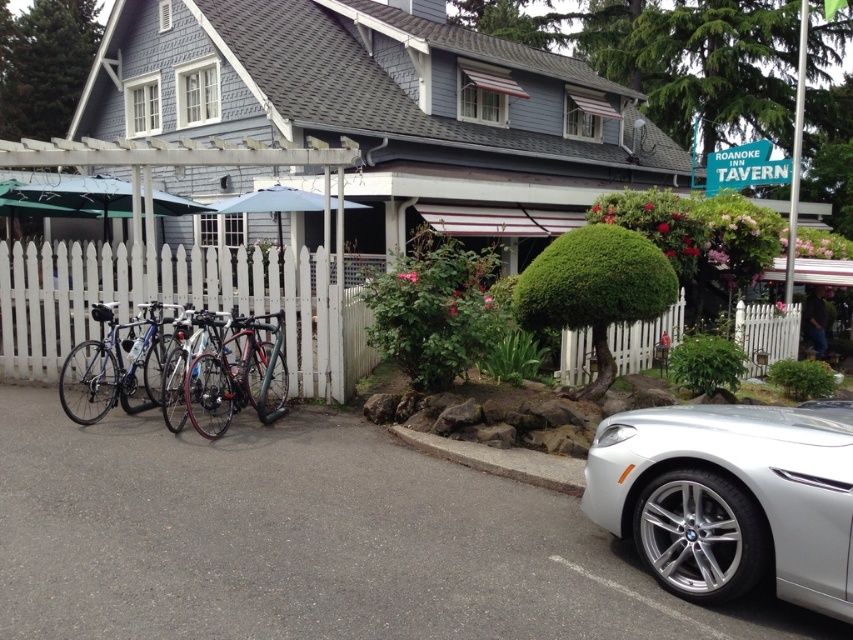
Can you confirm if white picket fence at left is shorter than shiny silver bicycle at center?

Yes, white picket fence at left is shorter than shiny silver bicycle at center.

Measure the distance from white picket fence at left to shiny silver bicycle at center.

The distance of white picket fence at left from shiny silver bicycle at center is 7.95 feet.

Measure the distance between white picket fence at left and camera.

A distance of 9.41 meters exists between white picket fence at left and camera.

Where is `white picket fence at left`? The image size is (853, 640). white picket fence at left is located at coordinates (183, 301).

Can you confirm if silver metallic car at lower right is thinner than white picket fence at left?

In fact, silver metallic car at lower right might be wider than white picket fence at left.

Who is more distant from viewer, [701,483] or [57,324]?

Point [57,324]

At what (x,y) coordinates should I click in order to perform the action: click on silver metallic car at lower right. Please return your answer as a coordinate pair (x, y). Looking at the image, I should click on (730, 499).

Does point (265, 376) come behind point (200, 326)?

Yes, point (265, 376) is behind point (200, 326).

Is shiny black bicycle at center wider than shiny silver bicycle at center?

Correct, the width of shiny black bicycle at center exceeds that of shiny silver bicycle at center.

The height and width of the screenshot is (640, 853). What do you see at coordinates (236, 372) in the screenshot?
I see `shiny black bicycle at center` at bounding box center [236, 372].

Identify the location of shiny black bicycle at center. The image size is (853, 640). (236, 372).